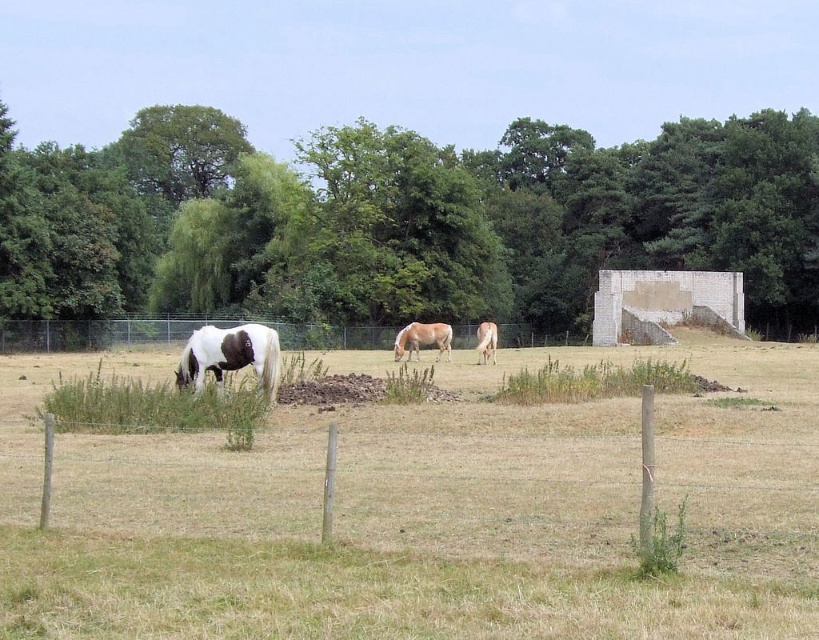
You are a farmer checking the field. You see the light brown horse at center and the white glossy horse at center. Which horse is positioned higher in the image?

The light brown horse at center is positioned higher in the image than the white glossy horse at center.